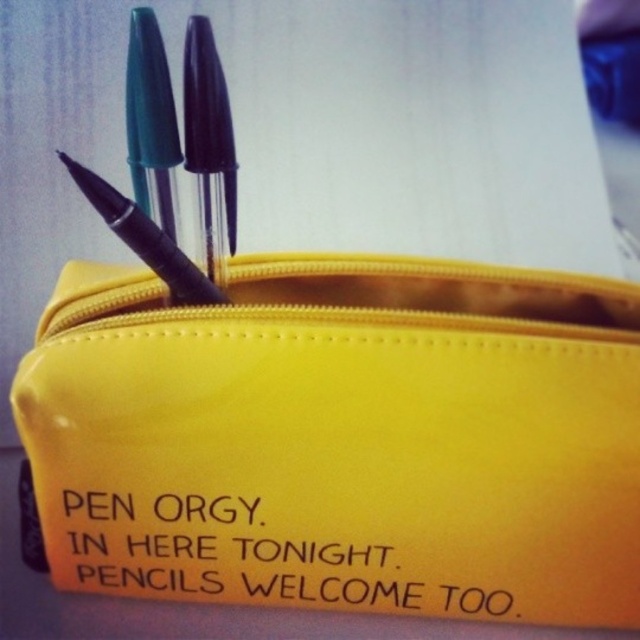
Who is taller, yellow vinyl pouch at center or matte black pencil at upper center?

With more height is yellow vinyl pouch at center.

Who is shorter, yellow vinyl pouch at center or matte black pencil at upper center?

matte black pencil at upper center

Which is in front, point (326, 528) or point (150, 266)?

Point (150, 266) is more forward.

I want to click on yellow vinyl pouch at center, so click(x=342, y=438).

Can you confirm if yellow matte text at center is wider than matte black pencil at upper center?

Correct, the width of yellow matte text at center exceeds that of matte black pencil at upper center.

Which of these two, yellow matte text at center or matte black pencil at upper center, stands taller?

yellow matte text at center

Identify the location of yellow matte text at center. (282, 547).

Who is more forward, [144,442] or [304,595]?

Point [144,442] is in front.

Which is more to the right, yellow vinyl pouch at center or yellow matte text at center?

yellow vinyl pouch at center

Between point (113, 528) and point (250, 602), which one is positioned behind?

The point (250, 602) is more distant.

Find the location of `yellow vinyl pouch at center`. yellow vinyl pouch at center is located at coordinates (342, 438).